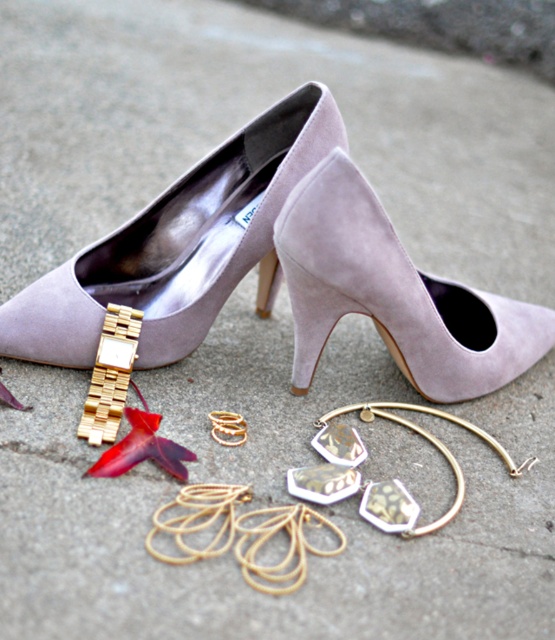
Question: Is suede-like purple shoe at upper center bigger than suede heel at center?

Choices:
 (A) yes
 (B) no

Answer: (A)

Question: Which object appears closest to the camera in this image?

Choices:
 (A) gold metallic watch at lower left
 (B) suede heel at center
 (C) suede-like purple shoe at upper center
 (D) suede at upper center

Answer: (D)

Question: Which object appears farthest from the camera in this image?

Choices:
 (A) suede-like purple shoe at upper center
 (B) suede heel at center

Answer: (B)

Question: Does suede-like purple shoe at upper center have a lesser width compared to gold metallic watch at lower left?

Choices:
 (A) yes
 (B) no

Answer: (B)

Question: Which point is closer to the camera taking this photo?

Choices:
 (A) (88, 406)
 (B) (259, 268)

Answer: (A)

Question: Is suede-like purple shoe at upper center wider than suede heel at center?

Choices:
 (A) yes
 (B) no

Answer: (A)